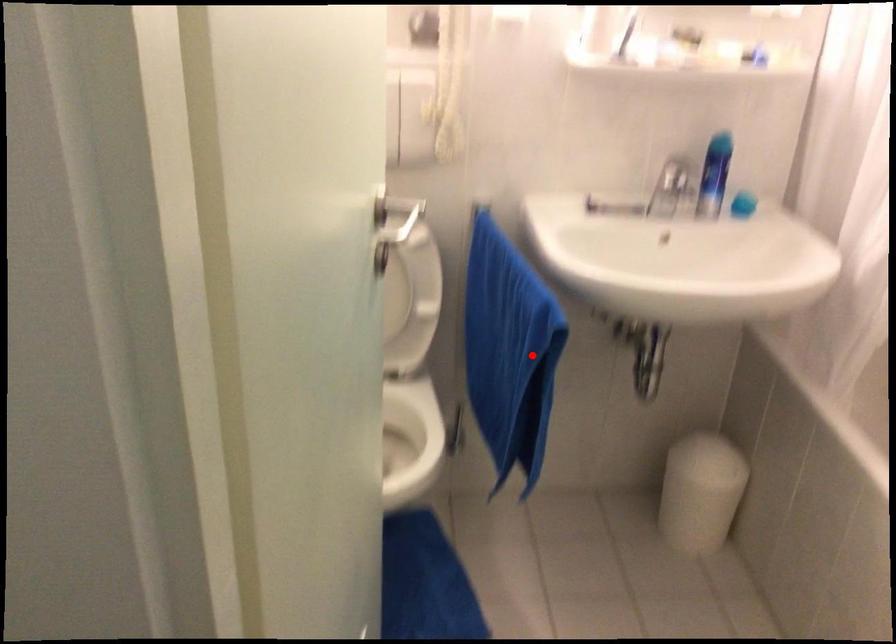
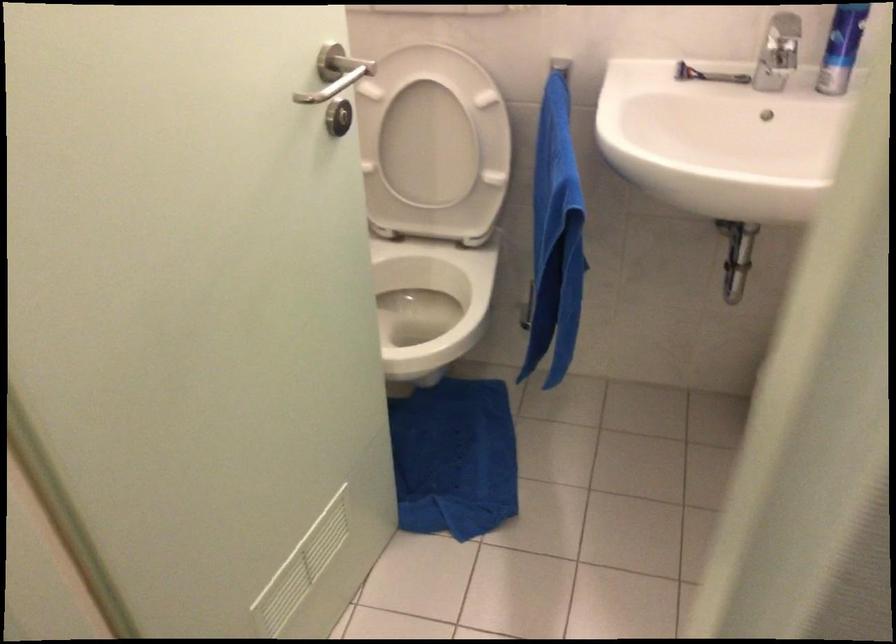
Find the pixel in the second image that matches the highlighted location in the first image.

(555, 238)